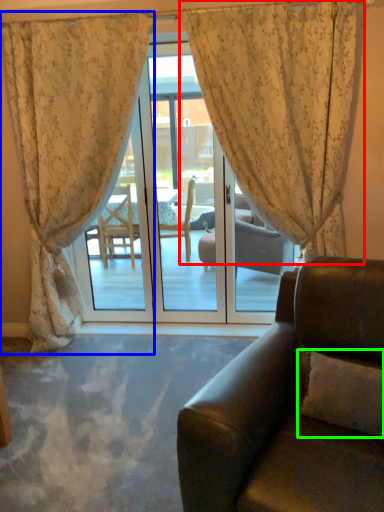
Question: Which is farther away from curtain (highlighted by a red box)? curtain (highlighted by a blue box) or pillow (highlighted by a green box)?

Choices:
 (A) curtain
 (B) pillow

Answer: (B)